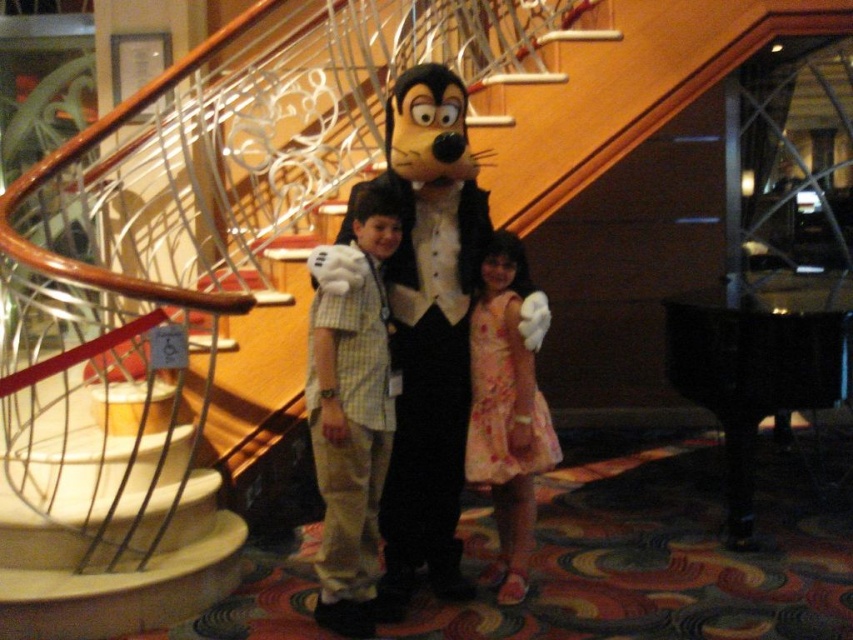
Who is positioned more to the right, white plush mascot at center or floral cotton dress at center?

floral cotton dress at center

Is white plush mascot at center above floral cotton dress at center?

Indeed, white plush mascot at center is positioned over floral cotton dress at center.

Is point (431, 225) closer to viewer compared to point (492, 392)?

Yes, it is in front of point (492, 392).

Locate an element on the screen. This screenshot has height=640, width=853. white plush mascot at center is located at coordinates (428, 324).

Which of these two, light brown cotton pants at center or floral cotton dress at center, stands taller?

light brown cotton pants at center

Can you confirm if light brown cotton pants at center is wider than floral cotton dress at center?

No, light brown cotton pants at center is not wider than floral cotton dress at center.

Which is in front, point (343, 433) or point (515, 509)?

Point (343, 433) is more forward.

At what (x,y) coordinates should I click in order to perform the action: click on light brown cotton pants at center. Please return your answer as a coordinate pair (x, y). Looking at the image, I should click on (352, 413).

Between white plush mascot at center and light brown cotton pants at center, which one has more height?

With more height is white plush mascot at center.

Does white plush mascot at center have a lesser width compared to light brown cotton pants at center?

Incorrect, white plush mascot at center's width is not less than light brown cotton pants at center's.

Image resolution: width=853 pixels, height=640 pixels. What do you see at coordinates (428, 324) in the screenshot? I see `white plush mascot at center` at bounding box center [428, 324].

Find the location of a particular element. Image resolution: width=853 pixels, height=640 pixels. white plush mascot at center is located at coordinates (428, 324).